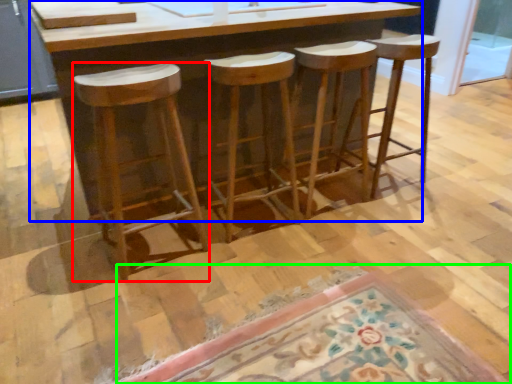
Question: Which object is positioned farthest from stool (highlighted by a red box)? Select from counter (highlighted by a blue box) and doormat (highlighted by a green box).

Choices:
 (A) counter
 (B) doormat

Answer: (B)